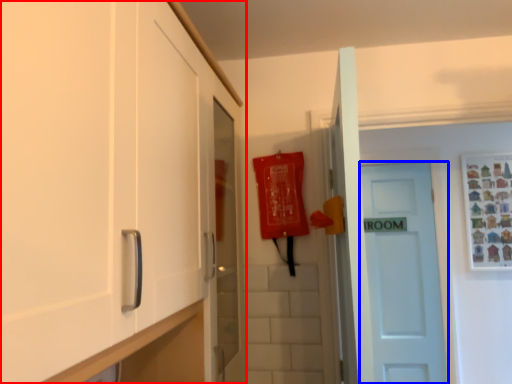
Question: Which point is further to the camera, cabinetry (highlighted by a red box) or door (highlighted by a blue box)?

Choices:
 (A) cabinetry
 (B) door

Answer: (B)